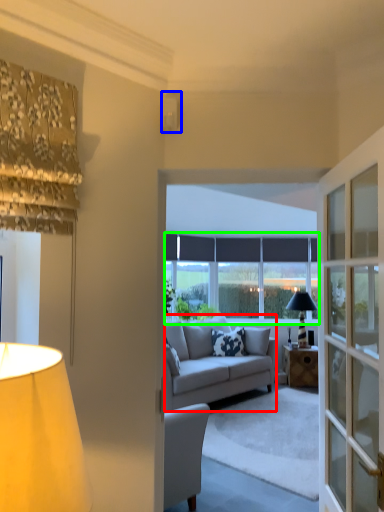
Question: Based on their relative distances, which object is nearer to studio couch (highlighted by a red box)? Choose from lamp (highlighted by a blue box) and window (highlighted by a green box).

Choices:
 (A) lamp
 (B) window

Answer: (B)